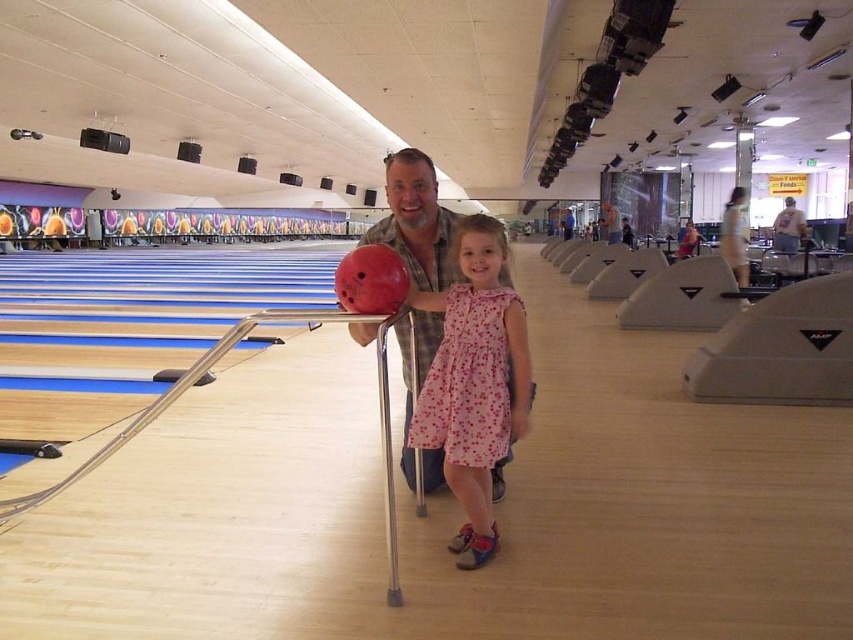
Question: Does pink floral dress at center appear on the left side of light brown leather jacket at upper center?

Choices:
 (A) no
 (B) yes

Answer: (B)

Question: Is pink floral dress at center thinner than matte brown shirt at center?

Choices:
 (A) no
 (B) yes

Answer: (B)

Question: Among these points, which one is nearest to the camera?

Choices:
 (A) (618, 225)
 (B) (424, 154)
 (C) (772, 244)

Answer: (B)

Question: Which point is closer to the camera?

Choices:
 (A) pink floral dress at center
 (B) light brown leather jacket at upper center
 (C) matte brown shirt at center

Answer: (A)

Question: Which point is farther to the camera?

Choices:
 (A) (416, 426)
 (B) (397, 246)

Answer: (B)

Question: From the image, what is the correct spatial relationship of matte brown shirt at center in relation to matte black bowling ball at center?

Choices:
 (A) above
 (B) below

Answer: (B)